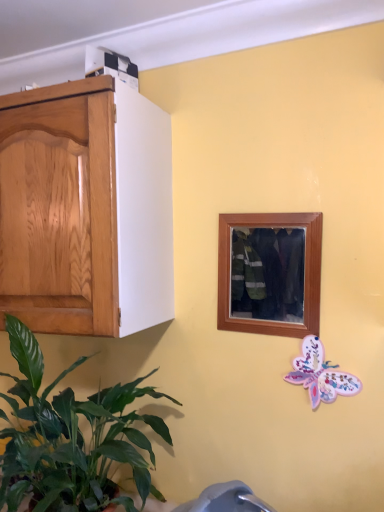
Locate an element on the screen. The height and width of the screenshot is (512, 384). pastel paper butterfly at lower right is located at coordinates (320, 374).

The height and width of the screenshot is (512, 384). Describe the element at coordinates (71, 438) in the screenshot. I see `green leafy plant at lower left` at that location.

Locate an element on the screen. pastel paper butterfly at lower right is located at coordinates (320, 374).

From a real-world perspective, is wooden picture frame at center physically located above or below green leafy plant at lower left?

wooden picture frame at center is situated higher than green leafy plant at lower left in the real world.

In the scene shown: Is wooden picture frame at center looking in the opposite direction of green leafy plant at lower left?

wooden picture frame at center does not have its back to green leafy plant at lower left.

The height and width of the screenshot is (512, 384). I want to click on picture frame positioned vertically above the green leafy plant at lower left (from a real-world perspective), so click(x=270, y=273).

Which of these two, green leafy plant at lower left or pastel paper butterfly at lower right, is bigger?

green leafy plant at lower left is bigger.

Who is more distant, green leafy plant at lower left or pastel paper butterfly at lower right?

pastel paper butterfly at lower right.

Considering the sizes of green leafy plant at lower left and pastel paper butterfly at lower right in the image, is green leafy plant at lower left taller or shorter than pastel paper butterfly at lower right?

Considering their sizes, green leafy plant at lower left has more height than pastel paper butterfly at lower right.

How different are the orientations of green leafy plant at lower left and pastel paper butterfly at lower right in degrees?

green leafy plant at lower left and pastel paper butterfly at lower right are facing 0.0208 degrees away from each other.

From the image's perspective, is pastel paper butterfly at lower right above green leafy plant at lower left?

Correct, pastel paper butterfly at lower right appears higher than green leafy plant at lower left in the image.

How different are the orientations of pastel paper butterfly at lower right and green leafy plant at lower left in degrees?

The angle between the facing direction of pastel paper butterfly at lower right and the facing direction of green leafy plant at lower left is 0.0208 degrees.

Is pastel paper butterfly at lower right positioned with its back to green leafy plant at lower left?

No, pastel paper butterfly at lower right's orientation is not away from green leafy plant at lower left.

From a real-world perspective, does pastel paper butterfly at lower right sit lower than green leafy plant at lower left?

Actually, pastel paper butterfly at lower right is physically above green leafy plant at lower left in the real world.

Is pastel paper butterfly at lower right a part of wooden picture frame at center?

That's incorrect, pastel paper butterfly at lower right is not inside wooden picture frame at center.

From the image's perspective, is wooden picture frame at center beneath pastel paper butterfly at lower right?

No.

Which of these two, wooden picture frame at center or pastel paper butterfly at lower right, is bigger?

wooden picture frame at center.

You are a GUI agent. You are given a task and a screenshot of the screen. Output one action in this format:
    pyautogui.click(x=<x>, y=<y>)
    Task: Click on the picture frame above the pastel paper butterfly at lower right (from a real-world perspective)
    This screenshot has height=512, width=384.
    Given the screenshot: What is the action you would take?
    pyautogui.click(x=270, y=273)

Locate an element on the screen. picture frame above the green leafy plant at lower left (from a real-world perspective) is located at coordinates (270, 273).

Is green leafy plant at lower left positioned with its back to wooden picture frame at center?

No, wooden picture frame at center is not at the back of green leafy plant at lower left.

Considering the points (108, 432) and (310, 281), which point is in front, point (108, 432) or point (310, 281)?

The point (108, 432) is closer to the camera.

From a real-world perspective, is pastel paper butterfly at lower right below wooden picture frame at center?

Indeed, from a real-world perspective, pastel paper butterfly at lower right is positioned beneath wooden picture frame at center.

Looking at their sizes, would you say pastel paper butterfly at lower right is wider or thinner than wooden picture frame at center?

In the image, pastel paper butterfly at lower right appears to be more narrow than wooden picture frame at center.

Can you tell me how much pastel paper butterfly at lower right and wooden picture frame at center differ in facing direction?

The angle between the facing direction of pastel paper butterfly at lower right and the facing direction of wooden picture frame at center is 0.0534 degrees.

What are the coordinates of `houseplant lying on the left of wooden picture frame at center` in the screenshot? It's located at (71, 438).

At what (x,y) coordinates should I click in order to perform the action: click on butterfly above the green leafy plant at lower left (from a real-world perspective). Please return your answer as a coordinate pair (x, y). Looking at the image, I should click on (320, 374).

From the image, which object appears to be farther from wooden picture frame at center, green leafy plant at lower left or pastel paper butterfly at lower right?

Based on the image, green leafy plant at lower left appears to be further to wooden picture frame at center.

Estimate the real-world distances between objects in this image. Which object is closer to green leafy plant at lower left, pastel paper butterfly at lower right or wooden picture frame at center?

wooden picture frame at center is closer to green leafy plant at lower left.

Looking at this image, considering their positions, is wooden picture frame at center positioned closer to green leafy plant at lower left than pastel paper butterfly at lower right?

wooden picture frame at center is positioned closer to the anchor green leafy plant at lower left.

Based on their spatial positions, is pastel paper butterfly at lower right or green leafy plant at lower left further from wooden picture frame at center?

green leafy plant at lower left.

Which object lies nearer to the anchor point pastel paper butterfly at lower right, green leafy plant at lower left or wooden picture frame at center?

wooden picture frame at center is closer to pastel paper butterfly at lower right.

Which object lies nearer to the anchor point pastel paper butterfly at lower right, wooden picture frame at center or green leafy plant at lower left?

wooden picture frame at center.

At what (x,y) coordinates should I click in order to perform the action: click on picture frame between green leafy plant at lower left and pastel paper butterfly at lower right. Please return your answer as a coordinate pair (x, y). The height and width of the screenshot is (512, 384). Looking at the image, I should click on (270, 273).